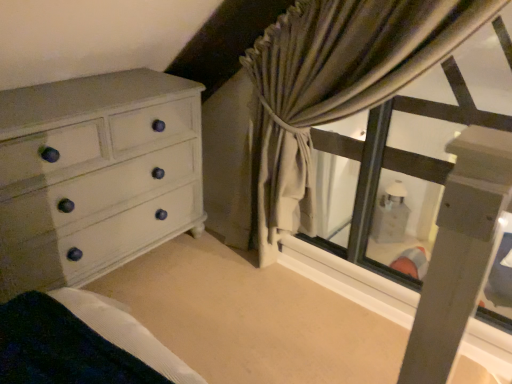
Question: From a real-world perspective, is white painted wood chest of drawers at left above or below textured beige curtain at upper right?

Choices:
 (A) below
 (B) above

Answer: (A)

Question: Is white painted wood chest of drawers at left wider or thinner than textured beige curtain at upper right?

Choices:
 (A) thin
 (B) wide

Answer: (B)

Question: Considering their positions, is white painted wood chest of drawers at left located in front of or behind textured beige curtain at upper right?

Choices:
 (A) front
 (B) behind

Answer: (B)

Question: Relative to white painted wood chest of drawers at left, is textured beige curtain at upper right in front or behind?

Choices:
 (A) front
 (B) behind

Answer: (A)

Question: From their relative heights in the image, would you say textured beige curtain at upper right is taller or shorter than white painted wood chest of drawers at left?

Choices:
 (A) short
 (B) tall

Answer: (B)

Question: Considering the positions of textured beige curtain at upper right and white painted wood chest of drawers at left in the image, is textured beige curtain at upper right bigger or smaller than white painted wood chest of drawers at left?

Choices:
 (A) big
 (B) small

Answer: (B)

Question: Considering the relative positions of textured beige curtain at upper right and white painted wood chest of drawers at left in the image provided, is textured beige curtain at upper right to the left or to the right of white painted wood chest of drawers at left?

Choices:
 (A) right
 (B) left

Answer: (A)